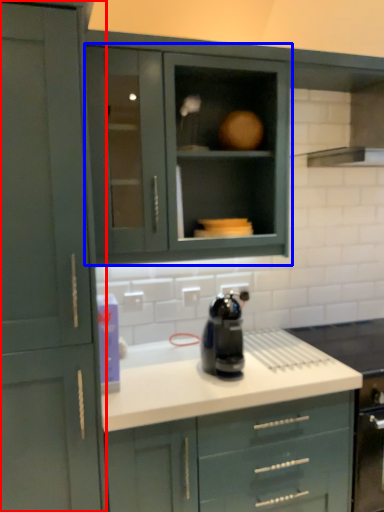
Question: Which point is closer to the camera, cabinetry (highlighted by a red box) or cabinetry (highlighted by a blue box)?

Choices:
 (A) cabinetry
 (B) cabinetry

Answer: (A)